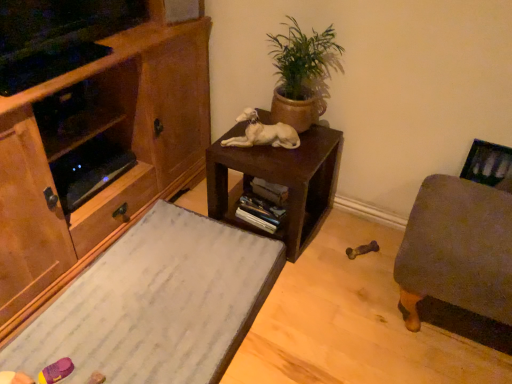
The height and width of the screenshot is (384, 512). What are the coordinates of `free location in front of brown matte table at center` in the screenshot? It's located at (317, 292).